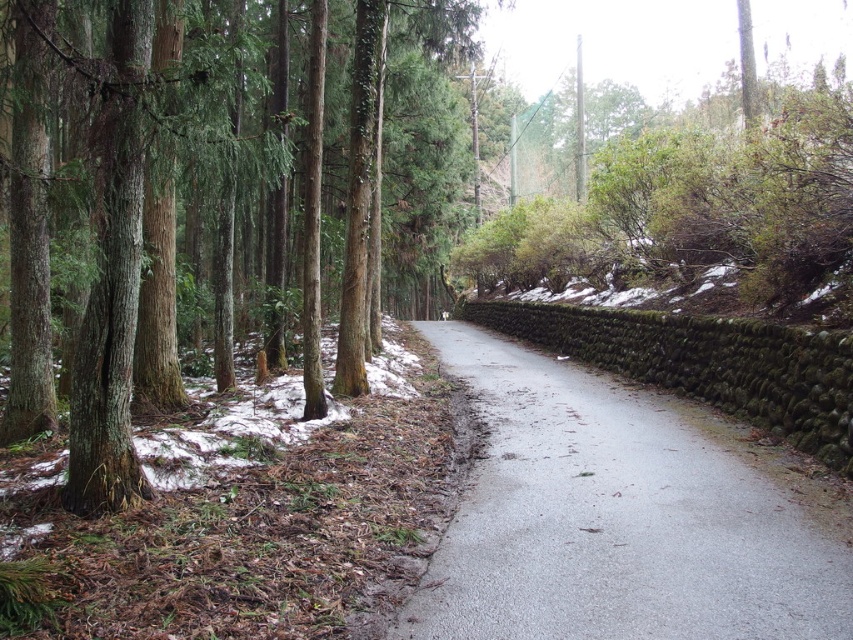
Who is taller, gray asphalt road at center or smooth brown tree trunk at left?

smooth brown tree trunk at left is taller.

Is point (563, 548) behind point (370, 292)?

No, (563, 548) is closer to viewer.

Find the location of a particular element. gray asphalt road at center is located at coordinates (618, 516).

The width and height of the screenshot is (853, 640). What are the coordinates of `gray asphalt road at center` in the screenshot? It's located at (618, 516).